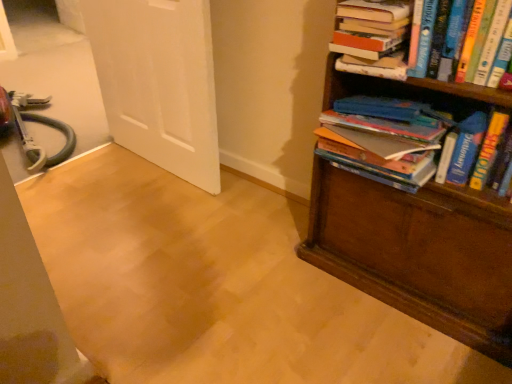
Question: Is hardcover books at right, which is the 3th book in top-to-bottom order, wider than hardcover book at upper right, the first book viewed from the top?

Choices:
 (A) no
 (B) yes

Answer: (B)

Question: From a real-world perspective, does hardcover books at right, the first book in the bottom-to-top sequence, sit lower than hardcover book at upper right, positioned as the third book in bottom-to-top order?

Choices:
 (A) no
 (B) yes

Answer: (B)

Question: From the image's perspective, is hardcover books at right, which is the 3th book in top-to-bottom order, above hardcover book at upper right, the first book viewed from the top?

Choices:
 (A) no
 (B) yes

Answer: (A)

Question: Is hardcover books at right, the first book in the bottom-to-top sequence, positioned beyond the bounds of hardcover book at upper right, the first book viewed from the top?

Choices:
 (A) yes
 (B) no

Answer: (A)

Question: Does hardcover books at right, which is the 3th book in top-to-bottom order, have a smaller size compared to hardcover book at upper right, positioned as the third book in bottom-to-top order?

Choices:
 (A) yes
 (B) no

Answer: (B)

Question: Are hardcover books at right, the first book in the bottom-to-top sequence, and hardcover book at upper right, the first book viewed from the top, located far from each other?

Choices:
 (A) no
 (B) yes

Answer: (A)

Question: Is hardcover books at right, which is the 3th book in top-to-bottom order, outside brown wooden bookcase at right?

Choices:
 (A) no
 (B) yes

Answer: (A)

Question: Does hardcover books at right, the first book in the bottom-to-top sequence, have a lesser height compared to brown wooden bookcase at right?

Choices:
 (A) no
 (B) yes

Answer: (B)

Question: Is hardcover books at right, which is the 3th book in top-to-bottom order, at the left side of brown wooden bookcase at right?

Choices:
 (A) no
 (B) yes

Answer: (B)

Question: Are hardcover books at right, the first book in the bottom-to-top sequence, and brown wooden bookcase at right beside each other?

Choices:
 (A) yes
 (B) no

Answer: (B)

Question: Is the position of hardcover books at right, which is the 3th book in top-to-bottom order, more distant than that of brown wooden bookcase at right?

Choices:
 (A) yes
 (B) no

Answer: (A)

Question: Can you confirm if hardcover books at right, which is the 3th book in top-to-bottom order, is thinner than brown wooden bookcase at right?

Choices:
 (A) no
 (B) yes

Answer: (A)

Question: Does white matte door at upper left have a lesser width compared to brown wooden bookcase at right?

Choices:
 (A) yes
 (B) no

Answer: (A)